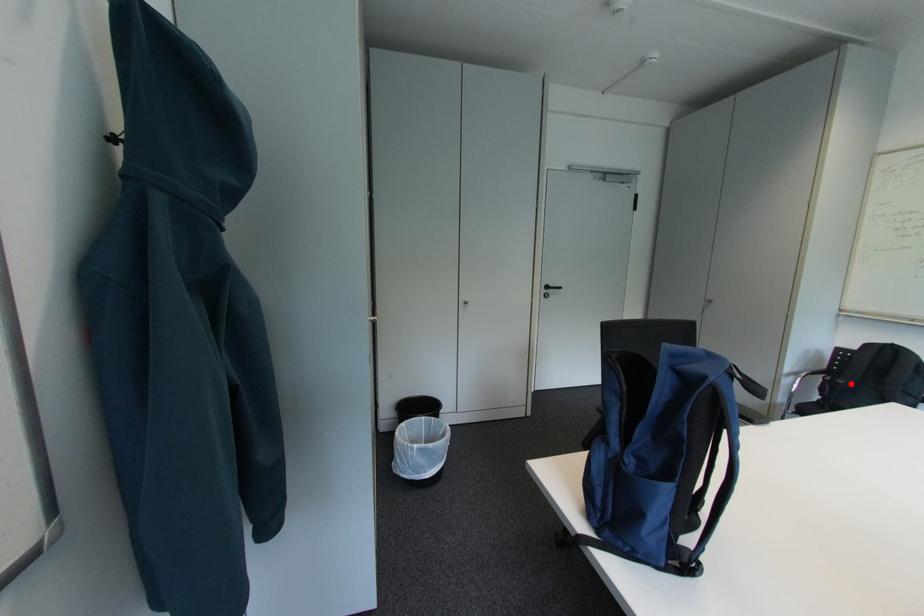
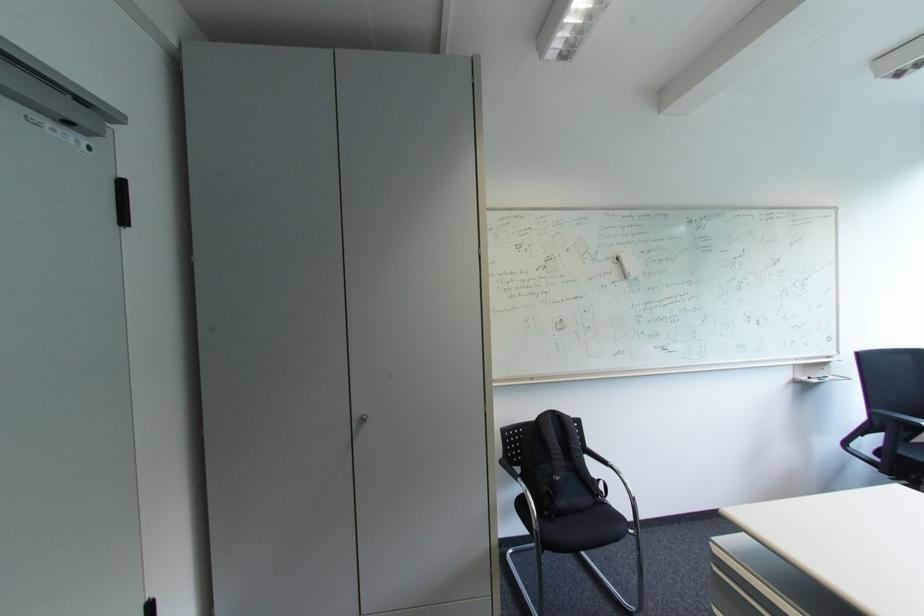
In the second image, find the point that corresponds to the highlighted location in the first image.

(566, 480)